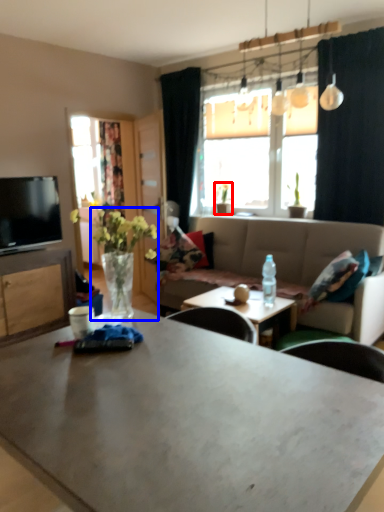
Question: Which point is closer to the camera, houseplant (highlighted by a red box) or floral arrangement (highlighted by a blue box)?

Choices:
 (A) houseplant
 (B) floral arrangement

Answer: (B)